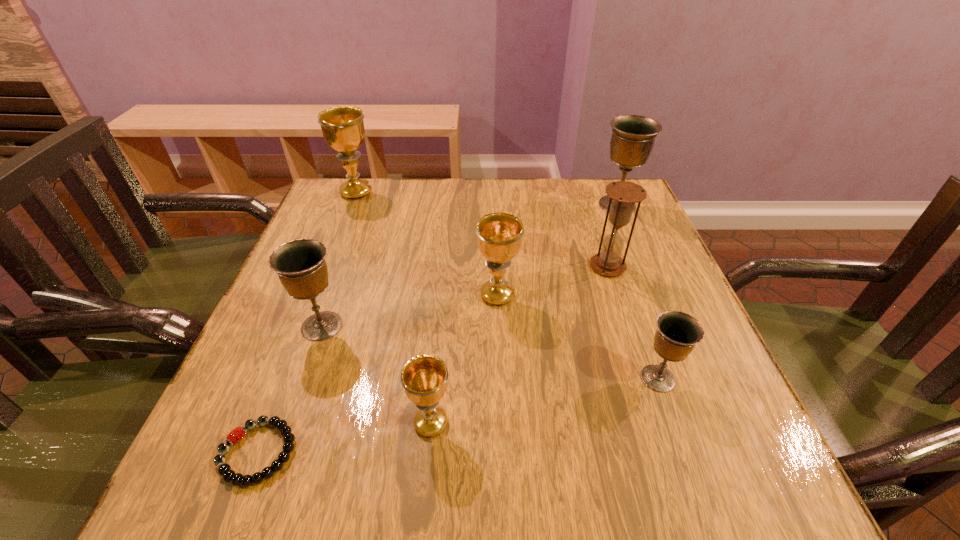
Identify the location of the third closest bronze chalice to the brown hourglass. The width and height of the screenshot is (960, 540). (300, 264).

Select which bronze chalice is the closest to the nearest bronze chalice. Please provide its 2D coordinates. Your answer should be formatted as a tuple, i.e. [(x, y)], where the tuple contains the x and y coordinates of a point satisfying the conditions above.

[(632, 141)]

Locate an element on the screen. The image size is (960, 540). vacant space that satisfies the following two spatial constraints: 1. on the front side of the biggest bronze chalice; 2. on the right side of the leftmost gold chalice is located at coordinates (351, 205).

I want to click on free space that satisfies the following two spatial constraints: 1. on the back side of the fourth object from right to left; 2. on the left side of the second farthest bronze chalice, so click(333, 295).